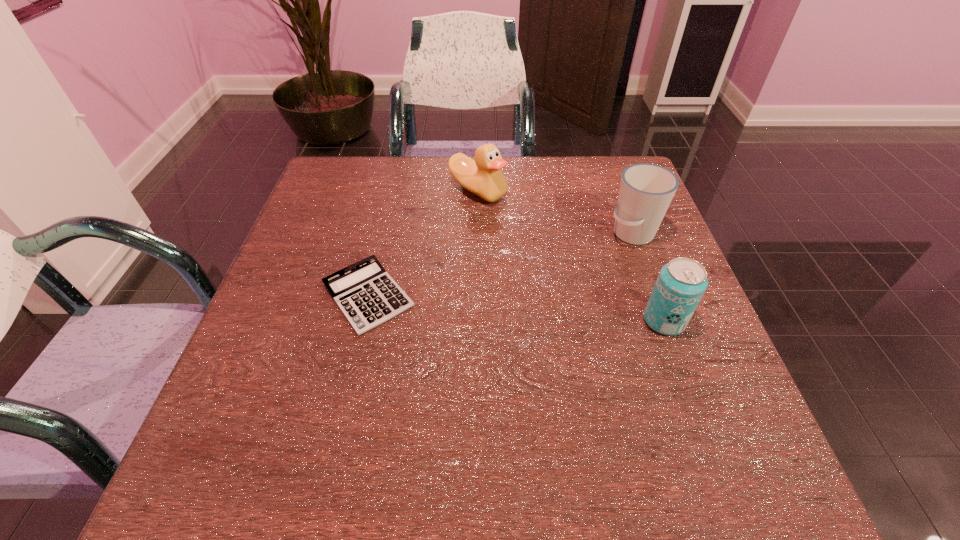
This screenshot has height=540, width=960. Identify the location of vacant space that satisfies the following two spatial constraints: 1. on the front side of the third nearest object; 2. on the right side of the second object from left to right. (478, 234).